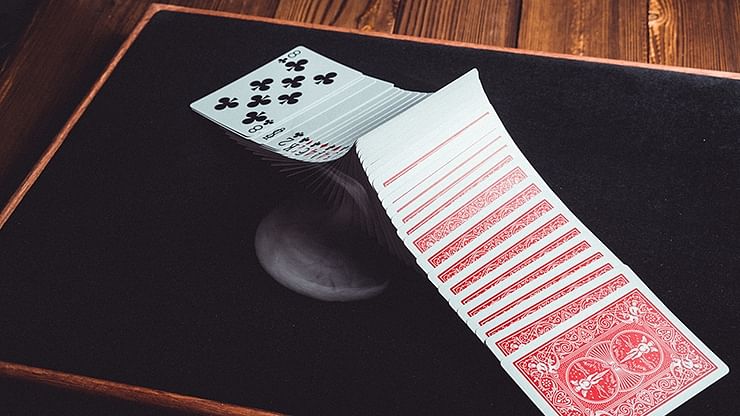
You are a GUI agent. You are given a task and a screenshot of the screen. Output one action in this format:
    pyautogui.click(x=<x>, y=<y>)
    Task: Click on the card holder
    The image size is (740, 416).
    Given the screenshot: What is the action you would take?
    pyautogui.click(x=331, y=229)